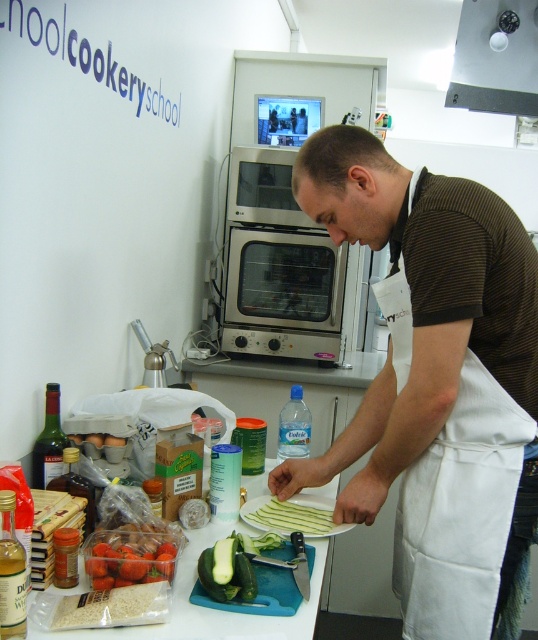
Question: Is blue plastic water bottle at center to the left of translucent glass bottle at left from the viewer's perspective?

Choices:
 (A) yes
 (B) no

Answer: (B)

Question: Does white matte rice at lower left have a greater width compared to green matte zucchini at center?

Choices:
 (A) yes
 (B) no

Answer: (B)

Question: Which object is closer to the camera taking this photo?

Choices:
 (A) brown textured shirt at center
 (B) white matte rice at lower left

Answer: (B)

Question: In this image, where is brown textured shirt at center located relative to green matte zucchini at center?

Choices:
 (A) right
 (B) left

Answer: (A)

Question: Which point appears closest to the camera in this image?

Choices:
 (A) (36, 477)
 (B) (173, 593)

Answer: (B)

Question: Which object is farther from the camera taking this photo?

Choices:
 (A) translucent glass bottle at left
 (B) metallic gray exhaust hood at upper center

Answer: (B)